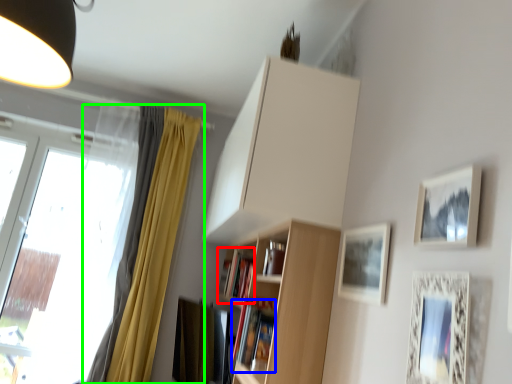
Question: Estimate the real-world distances between objects in this image. Which object is farther from book (highlighted by a red box), book (highlighted by a blue box) or curtain (highlighted by a green box)?

Choices:
 (A) book
 (B) curtain

Answer: (B)